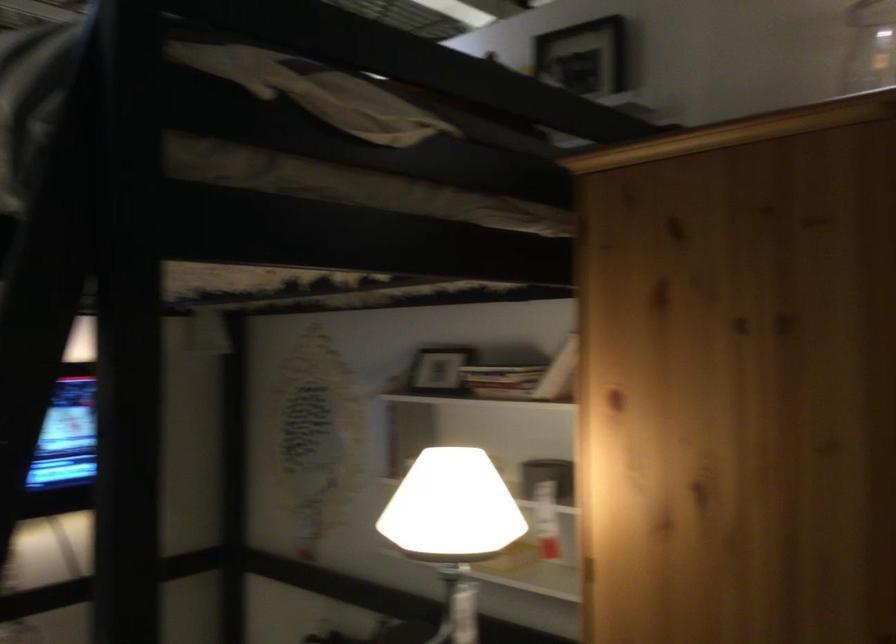
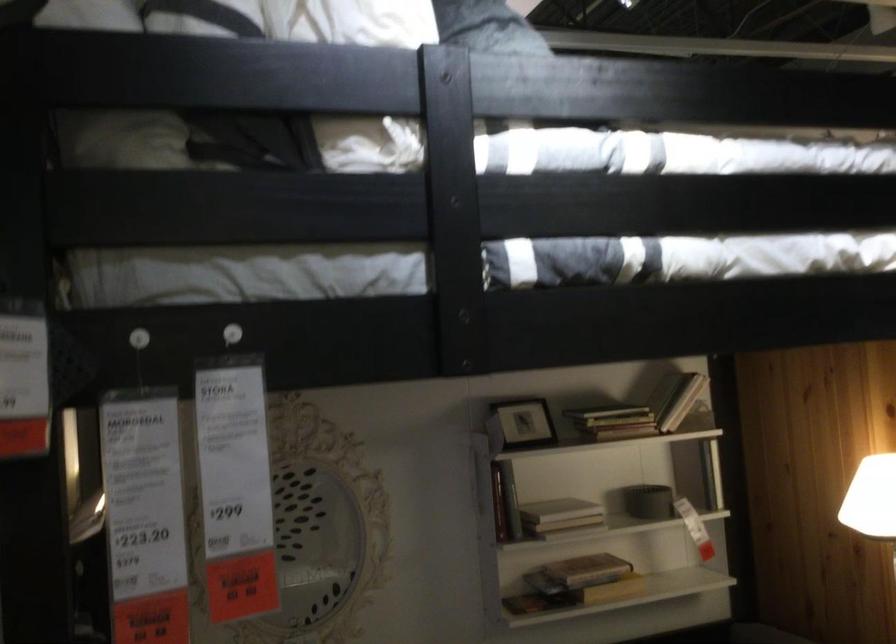
Where in the second image is the point corresponding to point (517, 476) from the first image?

(648, 502)